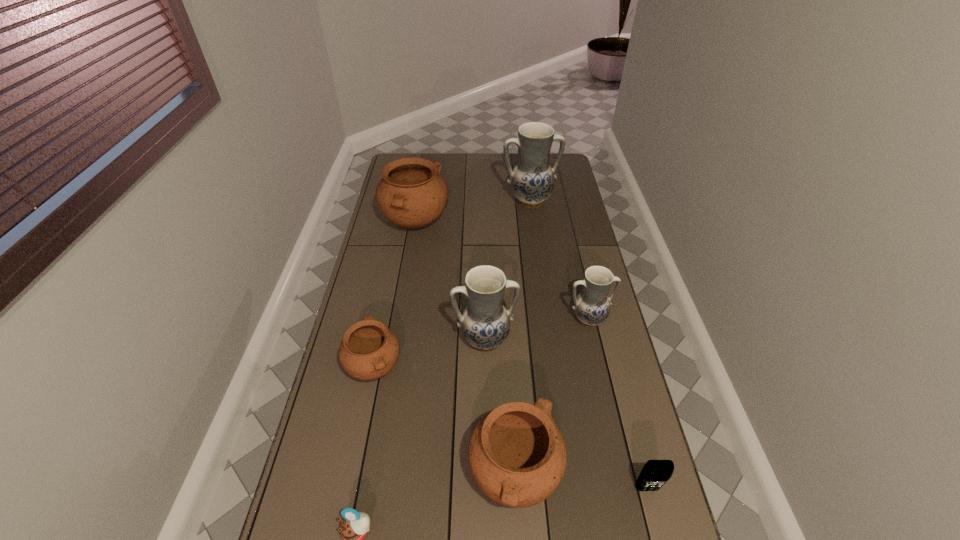
In the image, there is a desktop. Identify the location of free region at the far right corner. (567, 172).

Identify the location of vacant point located between the rightmost terracotta pottery and the smallest terracotta pottery. (444, 421).

The image size is (960, 540). Identify the location of blank region between the nearest pottery and the smallest blue pottery. (552, 397).

I want to click on free point between the smallest blue pottery and the second biggest blue pottery, so click(537, 329).

The height and width of the screenshot is (540, 960). I want to click on vacant space in between the smallest terracotta pottery and the tallest pottery, so click(x=452, y=283).

Find the location of a particular element. The height and width of the screenshot is (540, 960). vacant space in between the smallest blue pottery and the cellular telephone is located at coordinates (617, 404).

This screenshot has height=540, width=960. What are the coordinates of `object that is the fifth closest one to the second smallest blue pottery` in the screenshot? It's located at (655, 473).

This screenshot has width=960, height=540. I want to click on the fifth closest object to the cellular telephone, so click(369, 350).

Locate an element on the screen. pottery identified as the sixth closest to the pink muffin is located at coordinates (532, 179).

Where is `the second closest pottery relative to the cellular telephone`? the second closest pottery relative to the cellular telephone is located at coordinates [x=485, y=323].